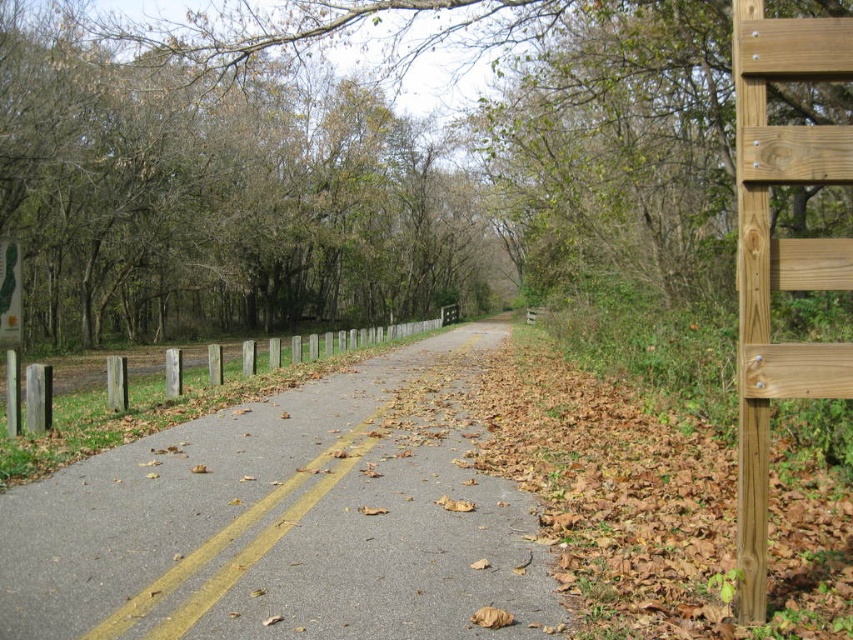
You are a cyclist riding on the gray asphalt road at center. You see the green plastic sign at left ahead. Can you safely pass around it without leaving the road?

The gray asphalt road at center might be wider than green plastic sign at left, so it is possible to pass around it without leaving the road, but there is uncertainty due to the word might.

You are standing at the start of the path and want to reach the point marked as point (3, 276). There is an obstacle at point (260, 589) blocking your way. Which point should you detour around to avoid the obstacle?

You should detour around point (260, 589) because it is closer to you than the destination point (3, 276), so you can go around it without deviating too far from your path.